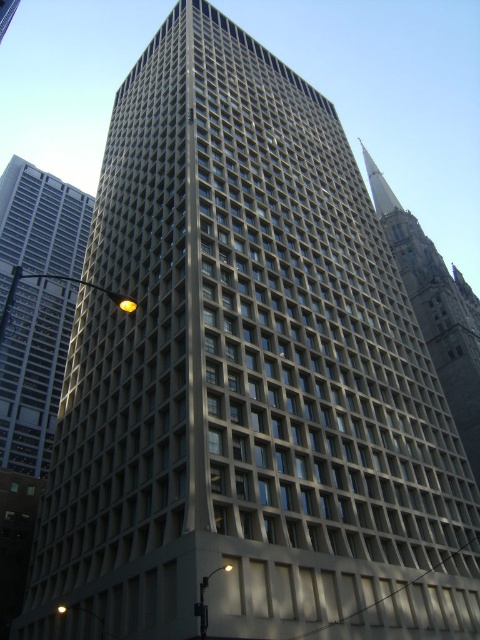
What are the coordinates of the silver glass skyscraper at left in the image?

The silver glass skyscraper at left is located at coordinates point (34, 372).

You are an architect analyzing the layout of the city skyline. You notice the silver glass skyscraper at left and the smooth gray tower at upper right. Which of these two structures is positioned higher in the sky? Please base your answer on their relative positions in the image.

The smooth gray tower at upper right is positioned higher in the sky than the silver glass skyscraper at left because it is located above it in the image.